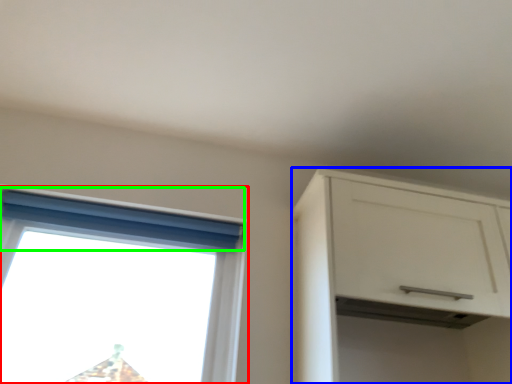
Question: Which object is positioned farthest from window (highlighted by a red box)? Select from cabinetry (highlighted by a blue box) and curtain (highlighted by a green box).

Choices:
 (A) cabinetry
 (B) curtain

Answer: (A)